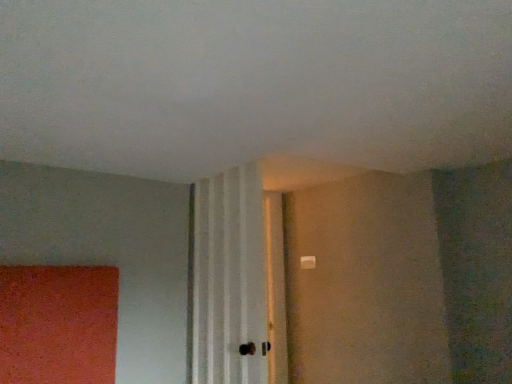
Question: Should I look upward or downward to see white textured curtain at center?

Choices:
 (A) down
 (B) up

Answer: (A)